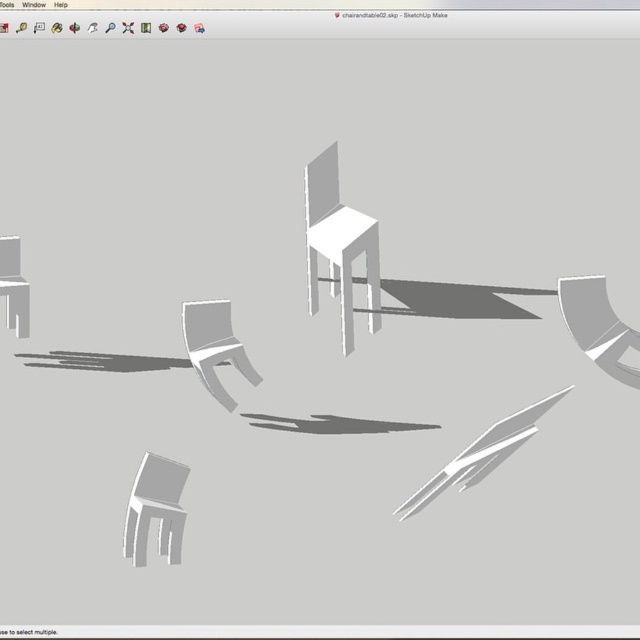
Question: Does matte gray chair at lower left have a lesser width compared to matte gray chair at center?

Choices:
 (A) yes
 (B) no

Answer: (A)

Question: Which is nearer to the white matte chair at center?

Choices:
 (A) matte gray chair at center
 (B) matte white cabinet at left

Answer: (A)

Question: Which object is the farthest from the matte white cabinet at left?

Choices:
 (A) matte gray chair at lower left
 (B) white matte chair at center
 (C) matte gray chair at center

Answer: (B)

Question: From the image, what is the correct spatial relationship of matte gray chair at lower left in relation to matte white cabinet at left?

Choices:
 (A) above
 (B) below

Answer: (B)

Question: Which of the following is the closest to the observer?

Choices:
 (A) (216, 307)
 (B) (333, 272)
 (C) (16, 298)
 (D) (140, 497)

Answer: (D)

Question: Is matte gray chair at lower left to the left of matte white cabinet at left from the viewer's perspective?

Choices:
 (A) yes
 (B) no

Answer: (B)